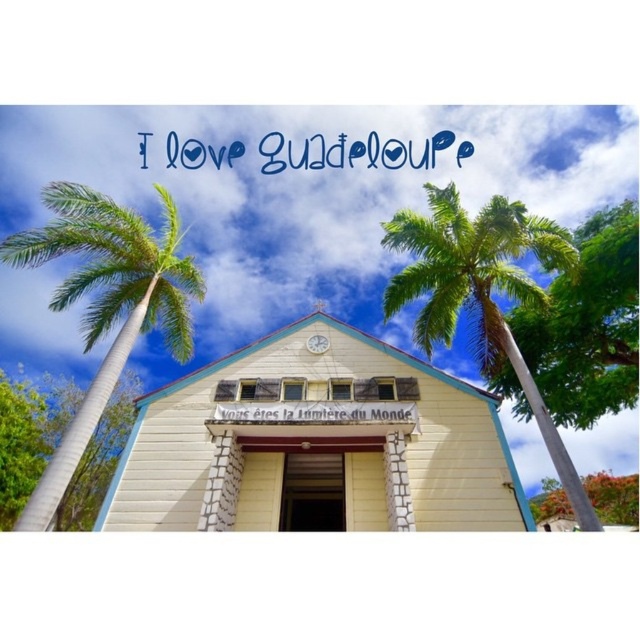
Question: Does white wood chapel at center have a larger size compared to green leafy palm tree at left?

Choices:
 (A) no
 (B) yes

Answer: (A)

Question: Which of these objects is positioned farthest from the green leafy palm tree at center?

Choices:
 (A) green leafy palm tree at left
 (B) white wood chapel at center

Answer: (A)

Question: Which object appears closest to the camera in this image?

Choices:
 (A) green leafy palm tree at center
 (B) white wood chapel at center
 (C) green leafy palm tree at left

Answer: (C)

Question: Estimate the real-world distances between objects in this image. Which object is closer to the green leafy palm tree at center?

Choices:
 (A) white wood chapel at center
 (B) green leafy palm tree at left

Answer: (A)

Question: Can you confirm if green leafy palm tree at left is wider than green leafy palm tree at center?

Choices:
 (A) no
 (B) yes

Answer: (B)

Question: Is white wood chapel at center above green leafy palm tree at left?

Choices:
 (A) no
 (B) yes

Answer: (A)